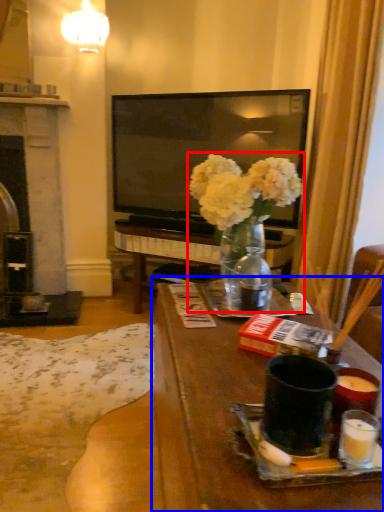
Question: Which object appears closest to the camera in this image, floral arrangement (highlighted by a red box) or table (highlighted by a blue box)?

Choices:
 (A) floral arrangement
 (B) table

Answer: (B)